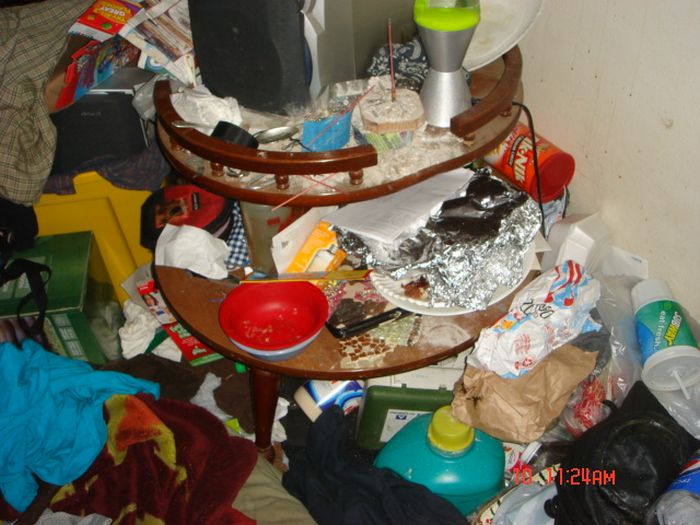
Where is `spoon`? This screenshot has height=525, width=700. spoon is located at coordinates (274, 133).